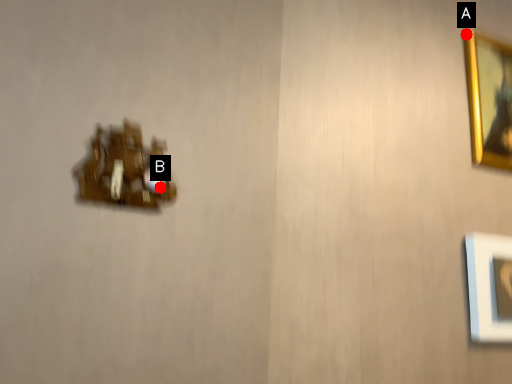
Question: Two points are circled on the image, labeled by A and B beside each circle. Which point is closer to the camera?

Choices:
 (A) A is closer
 (B) B is closer

Answer: (B)